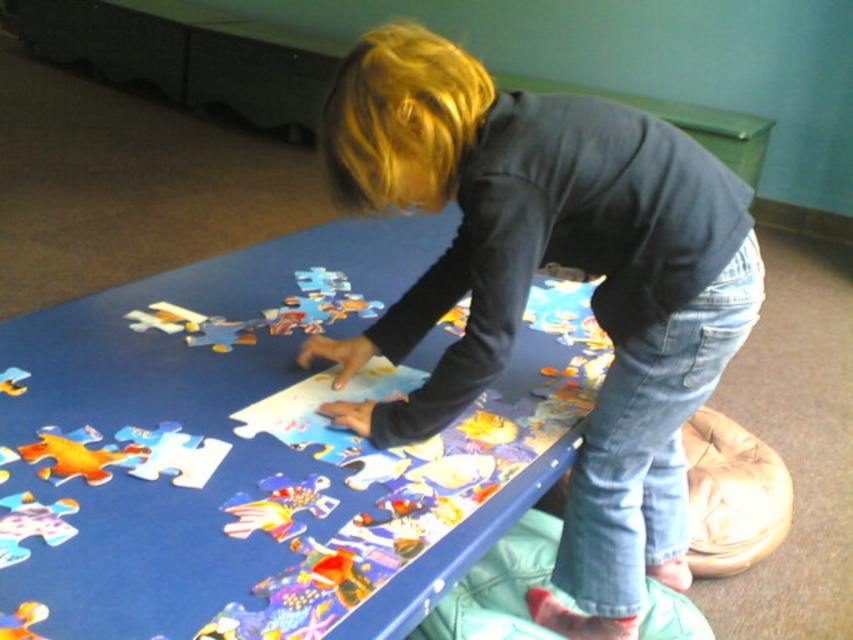
You are a parent observing your child at the blue table. You notice the blue cardboard puzzle board at center and the matte black shirt at center. Which object is positioned higher from the floor?

The blue cardboard puzzle board at center is located above the matte black shirt at center, so it is positioned higher from the floor.